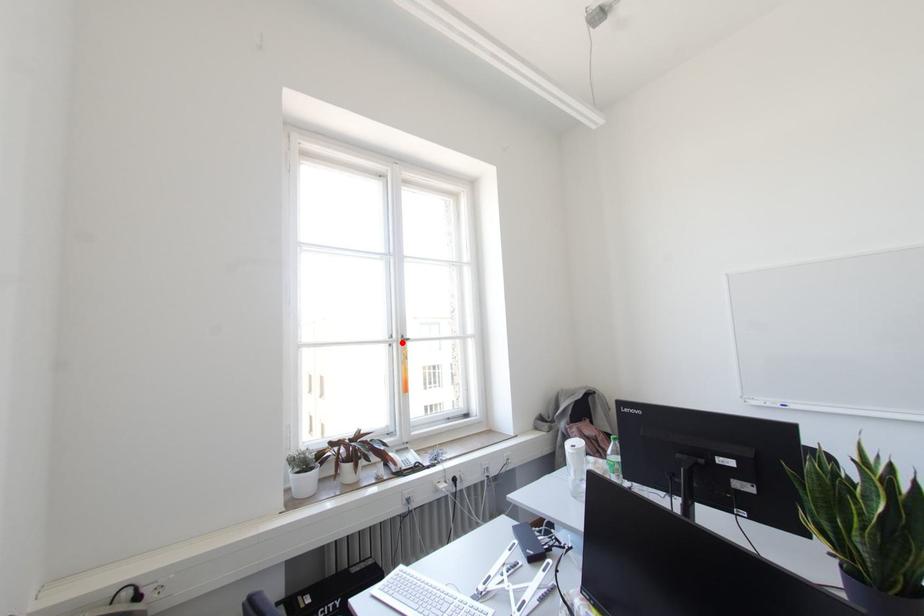
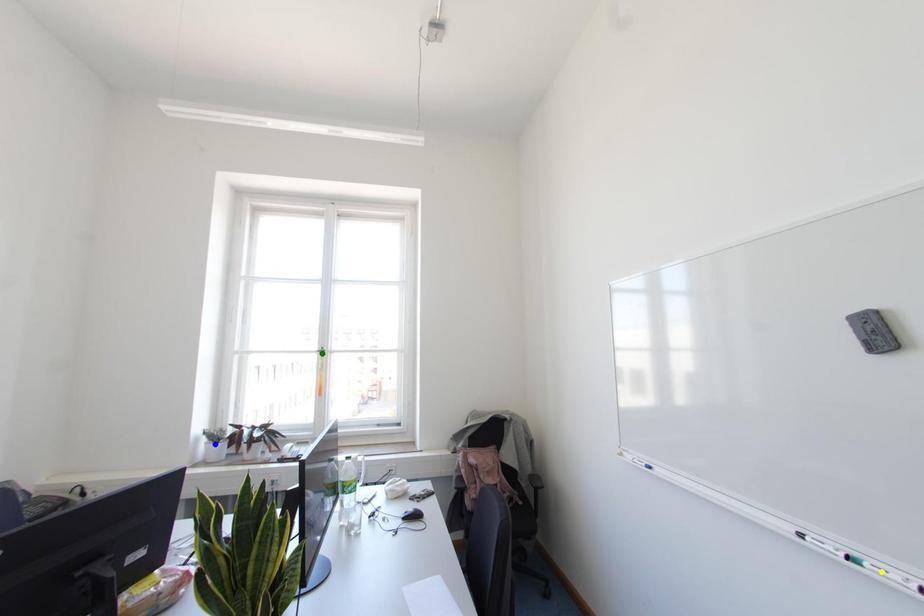
Question: I am providing you with two images of the same scene from different viewpoints. A red point is marked on the first image. You are given multiple points on the second image. In image 2, which mark is for the same physical point as the one in image 1?

Choices:
 (A) yellow point
 (B) green point
 (C) blue point

Answer: (B)